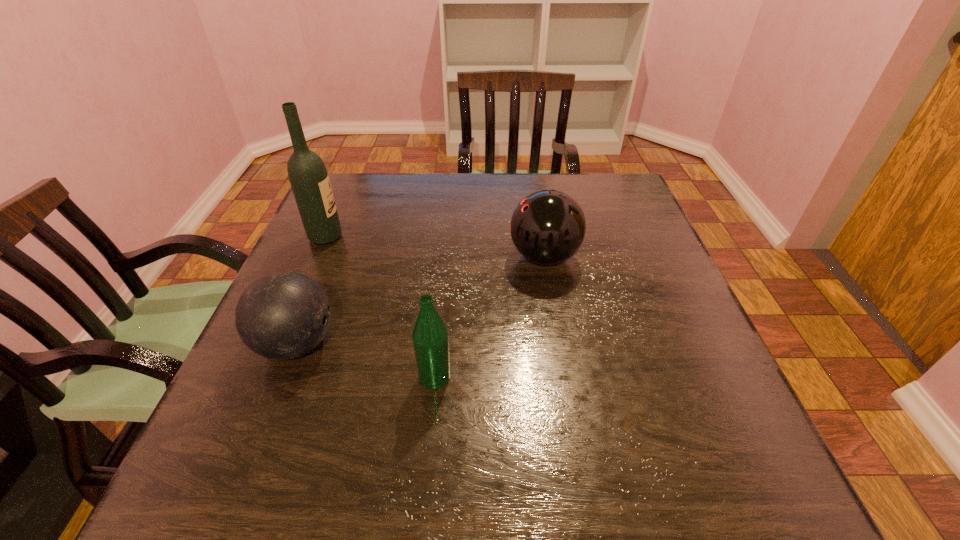
Locate an element on the screen. This screenshot has width=960, height=540. vacant area situated 0.130m on the grip area of the left bowling ball is located at coordinates (405, 344).

The width and height of the screenshot is (960, 540). In order to click on wine bottle present at the left edge in this screenshot , I will do `click(309, 180)`.

This screenshot has height=540, width=960. I want to click on bowling ball positioned at the left edge, so click(x=284, y=315).

In the image, there is a desktop. In order to click on vacant space at the far edge in this screenshot , I will do `click(464, 204)`.

In the image, there is a desktop. At what (x,y) coordinates should I click in order to perform the action: click on vacant space at the near edge. Please return your answer as a coordinate pair (x, y). Image resolution: width=960 pixels, height=540 pixels. Looking at the image, I should click on pyautogui.click(x=305, y=456).

I want to click on vacant space at the left edge of the desktop, so click(x=342, y=222).

Locate an element on the screen. free region at the right edge of the desktop is located at coordinates (612, 221).

Locate an element on the screen. The height and width of the screenshot is (540, 960). free location at the near left corner is located at coordinates click(180, 488).

Identify the location of free location at the far right corner of the desktop. This screenshot has height=540, width=960. (589, 207).

In the image, there is a desktop. Identify the location of vacant space at the near right corner. This screenshot has width=960, height=540. click(x=712, y=508).